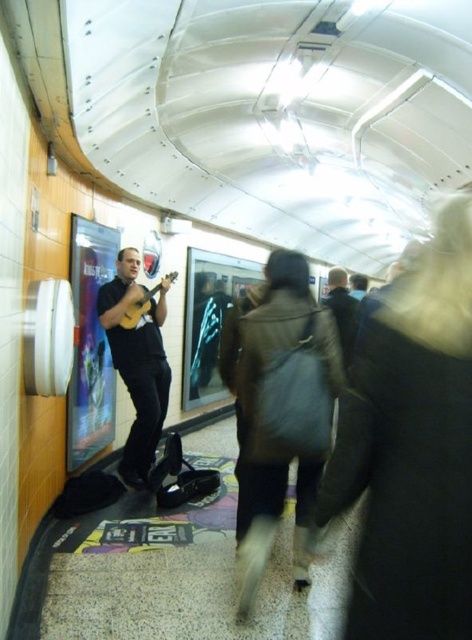
You are a photographer standing in the subway passage. You want to take a photo of the matte black ukulele at left and the yellow matte guitar at left. Which one is positioned lower in the frame?

The matte black ukulele at left is positioned lower in the frame because it is below the yellow matte guitar at left.

You are a photographer trying to capture the entire scene in one shot. The matte black ukulele at left and the dark brown leather jacket at center are both in your frame. Since you want to ensure both are visible, which object should you focus on first to maintain clarity, considering their sizes?

The matte black ukulele at left is larger in size than the dark brown leather jacket at center, so focusing on the matte black ukulele at left first would help maintain clarity for both objects.